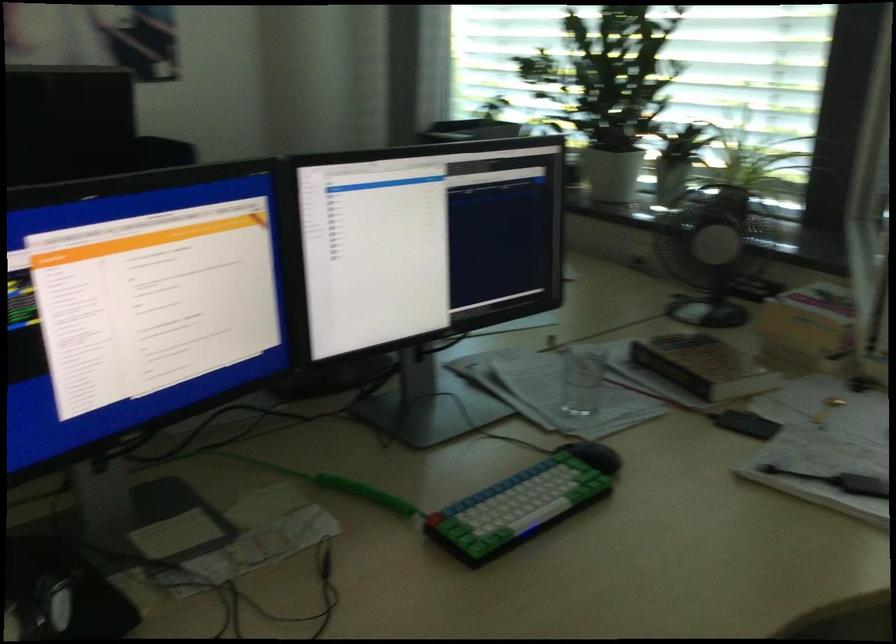
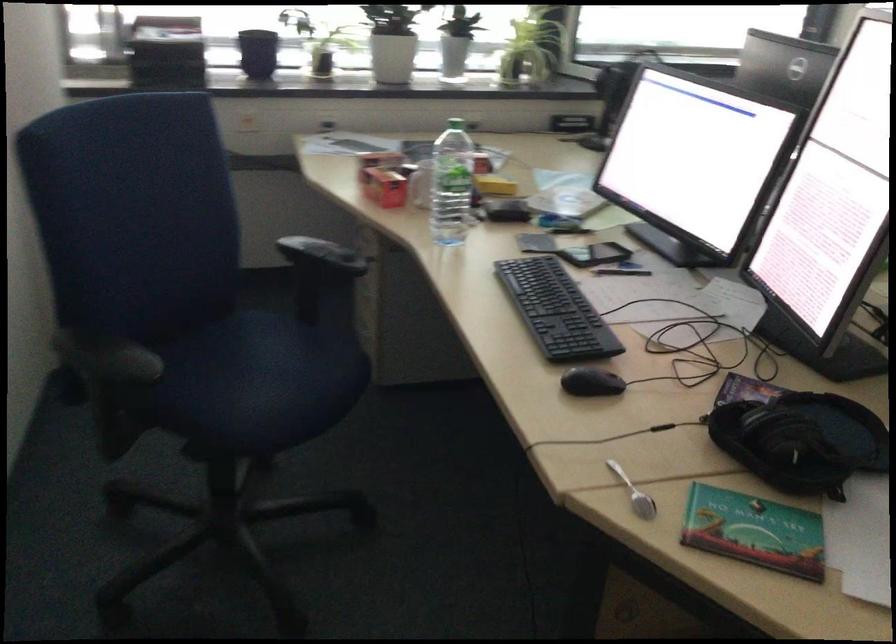
Question: I am providing you with two images of the same scene from different viewpoints. Which of the following objects are not visible in image2?

Choices:
 (A) black computer mouse
 (B) recessed wall handle
 (C) brown hardcover book
 (D) red cardboard box

Answer: (C)